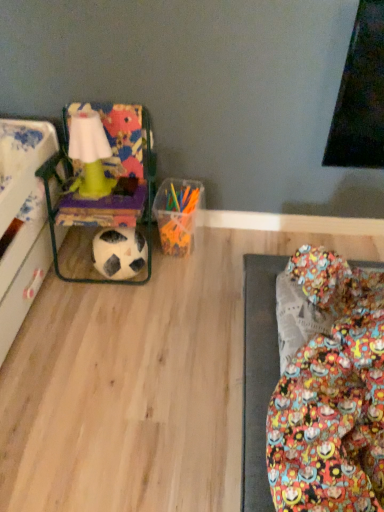
The width and height of the screenshot is (384, 512). I want to click on vacant area to the right of black matte football at lower left, so click(177, 279).